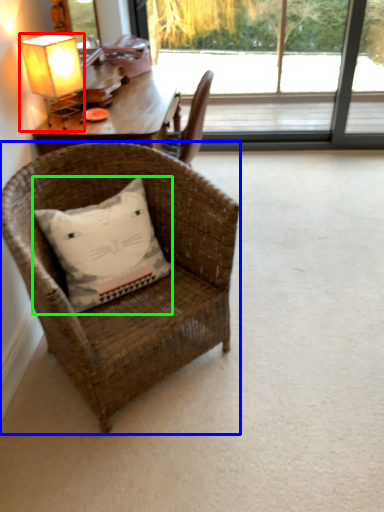
Question: Estimate the real-world distances between objects in this image. Which object is farther from lamp (highlighted by a red box), chair (highlighted by a blue box) or pillow (highlighted by a green box)?

Choices:
 (A) chair
 (B) pillow

Answer: (A)